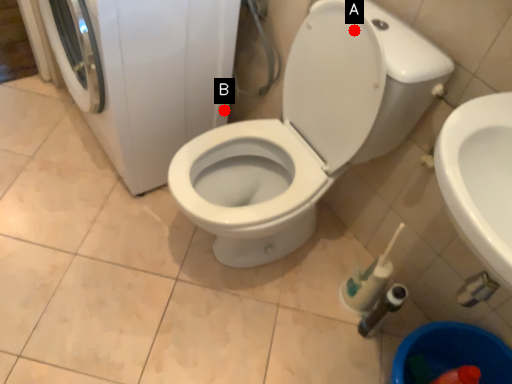
Question: Two points are circled on the image, labeled by A and B beside each circle. Among these points, which one is farthest from the camera?

Choices:
 (A) A is further
 (B) B is further

Answer: (B)